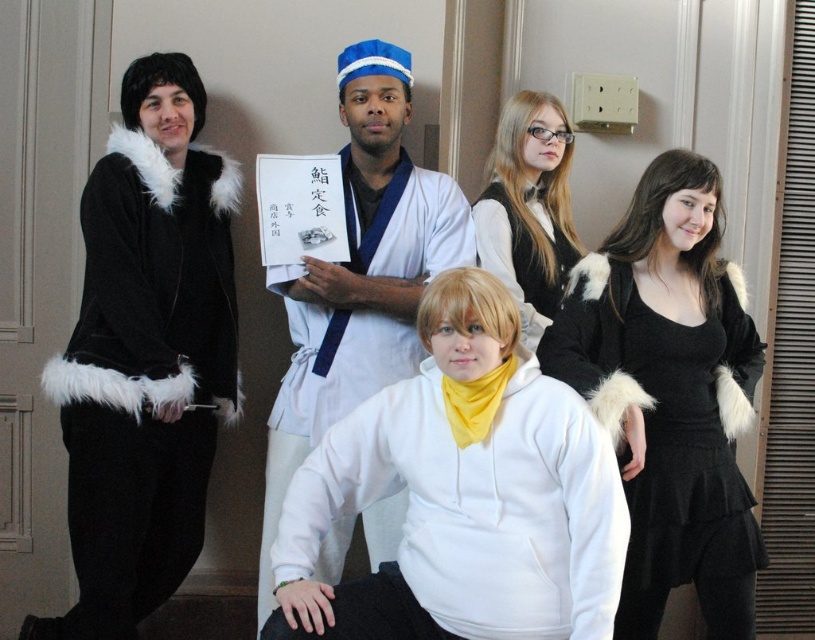
Which is behind, point (203, 416) or point (542, 275)?

Positioned behind is point (203, 416).

Between black velvet fur-trimmed robe at left and smooth black dress at upper right, which one has less height?

With less height is smooth black dress at upper right.

Which is behind, point (108, 260) or point (567, 152)?

The point (567, 152) is more distant.

Identify the location of black velvet fur-trimmed robe at left. (144, 376).

Which is in front, point (721, 298) or point (363, 164)?

Point (721, 298) is more forward.

Between black fur-trimmed dress at right and white cotton kimono at center, which one appears on the right side from the viewer's perspective?

black fur-trimmed dress at right

Who is more forward, [725,378] or [344,86]?

Positioned in front is point [725,378].

You are a GUI agent. You are given a task and a screenshot of the screen. Output one action in this format:
    pyautogui.click(x=<x>, y=<y>)
    Task: Click on the black fur-trimmed dress at right
    
    Given the screenshot: What is the action you would take?
    pyautogui.click(x=672, y=392)

Between black velvet fur-trimmed robe at left and white fleece hoodie at center, which one appears on the left side from the viewer's perspective?

black velvet fur-trimmed robe at left

Can you confirm if black velvet fur-trimmed robe at left is thinner than white fleece hoodie at center?

Yes.

Image resolution: width=815 pixels, height=640 pixels. I want to click on black velvet fur-trimmed robe at left, so click(144, 376).